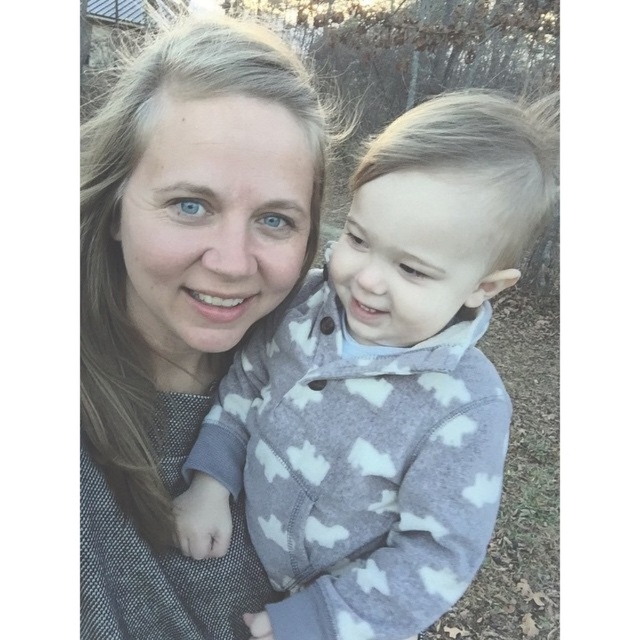
Consider the image. You are trying to decide which sweater to wear for a cold day. Both the fuzzy gray sweater at center and the matte gray sweater at center are available. Based on their sizes, which one would provide more warmth?

The fuzzy gray sweater at center has a larger size compared to the matte gray sweater at center, so it would provide more warmth because larger sweaters generally have more insulation.

You are a photographer standing at a distance of 70 centimeters from the fuzzy gray sweater at center. Can you adjust your position so that you are exactly 70 centimeters away from it?

The fuzzy gray sweater at center and viewer are 69.61 centimeters apart, which is very close to 70 centimeters. You can move slightly forward or backward to adjust your position to be exactly 70 centimeters away from the fuzzy gray sweater at center.

You are trying to decide which gray sweater to wear for a casual day out. You see both the fuzzy gray sweater at center and the matte gray sweater at center in the image. Which one is positioned higher on your body?

The fuzzy gray sweater at center is located above the matte gray sweater at center, so it is positioned higher on your body.